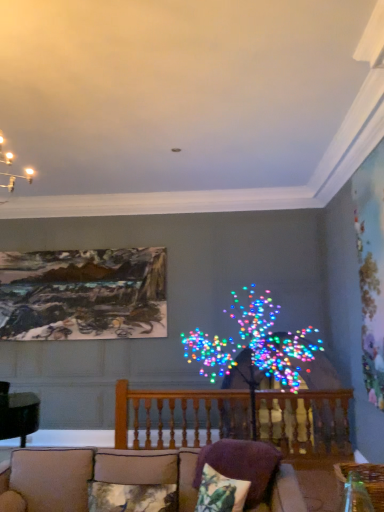
Question: Can wooden railing at center be found inside beige fabric couch at lower center?

Choices:
 (A) yes
 (B) no

Answer: (B)

Question: Is beige fabric couch at lower center far away from wooden railing at center?

Choices:
 (A) no
 (B) yes

Answer: (B)

Question: From the image's perspective, is beige fabric couch at lower center beneath wooden railing at center?

Choices:
 (A) yes
 (B) no

Answer: (B)

Question: Does beige fabric couch at lower center lie in front of wooden railing at center?

Choices:
 (A) yes
 (B) no

Answer: (A)

Question: Does beige fabric couch at lower center touch wooden railing at center?

Choices:
 (A) no
 (B) yes

Answer: (A)

Question: From the image's perspective, relative to purple fabric pillow at lower center, which is the 3th pillow in left-to-right order, is beige fabric couch at lower center above or below?

Choices:
 (A) above
 (B) below

Answer: (B)

Question: Is beige fabric couch at lower center bigger or smaller than purple fabric pillow at lower center, the 1th pillow from the right?

Choices:
 (A) big
 (B) small

Answer: (A)

Question: In terms of height, does beige fabric couch at lower center look taller or shorter compared to purple fabric pillow at lower center, the 1th pillow from the right?

Choices:
 (A) tall
 (B) short

Answer: (A)

Question: In the image, is beige fabric couch at lower center on the left side or the right side of purple fabric pillow at lower center, the 1th pillow from the right?

Choices:
 (A) left
 (B) right

Answer: (A)

Question: From their relative heights in the image, would you say fluffy fabric pillow at lower center, which ranks as the 1th pillow in left-to-right order, is taller or shorter than wooden railing at center?

Choices:
 (A) tall
 (B) short

Answer: (B)

Question: Visually, is fluffy fabric pillow at lower center, marked as the third pillow in a right-to-left arrangement, positioned to the left or to the right of wooden railing at center?

Choices:
 (A) left
 (B) right

Answer: (A)

Question: Is point [102, 481] closer or farther from the camera than point [226, 411]?

Choices:
 (A) closer
 (B) farther

Answer: (A)

Question: Is fluffy fabric pillow at lower center, marked as the third pillow in a right-to-left arrangement, spatially inside wooden railing at center, or outside of it?

Choices:
 (A) inside
 (B) outside

Answer: (B)

Question: From a real-world perspective, relative to purple fabric pillow at lower center, which is the 3th pillow in left-to-right order, is fluffy fabric pillow at lower center, which ranks as the 1th pillow in left-to-right order, vertically above or below?

Choices:
 (A) above
 (B) below

Answer: (B)

Question: Is fluffy fabric pillow at lower center, which ranks as the 1th pillow in left-to-right order, to the left or to the right of purple fabric pillow at lower center, the 1th pillow from the right, in the image?

Choices:
 (A) left
 (B) right

Answer: (A)